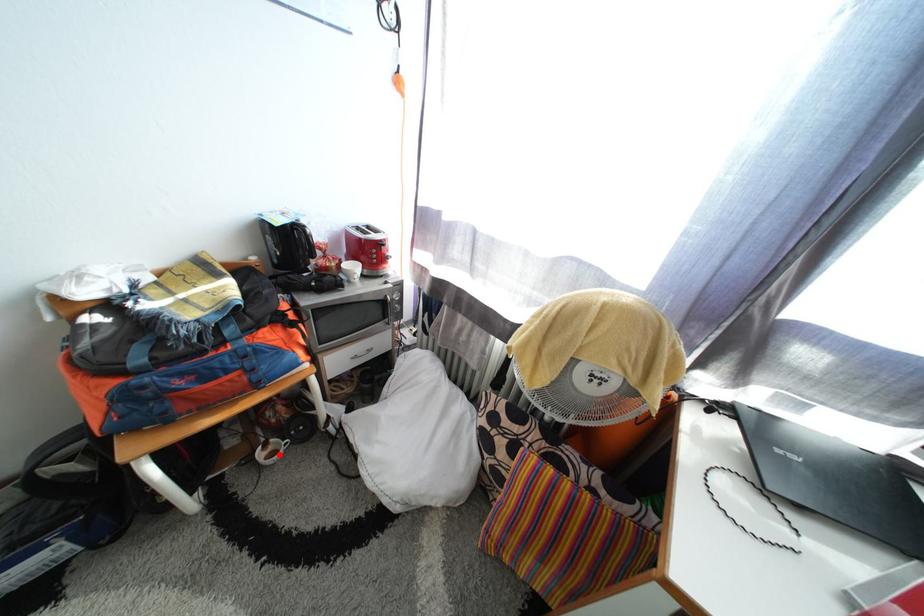
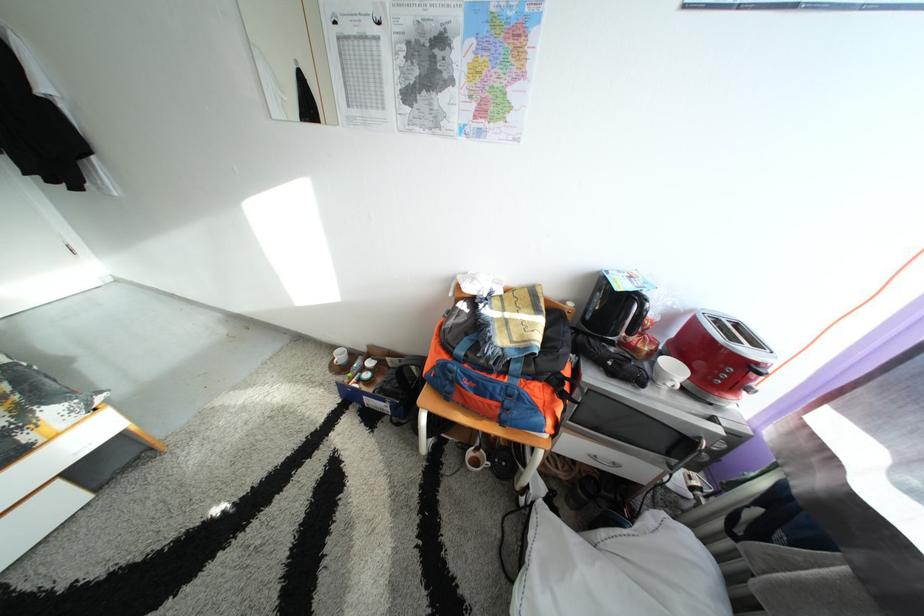
The point at the highlighted location is marked in the first image. Where is the corresponding point in the second image?

(487, 461)